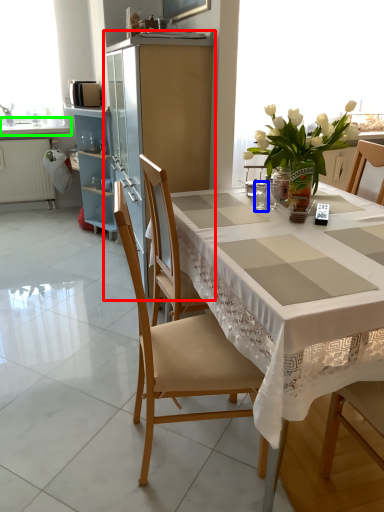
Question: Which object is the closest to the cabinetry (highlighted by a red box)? Choose among these: tableware (highlighted by a blue box) or countertop (highlighted by a green box).

Choices:
 (A) tableware
 (B) countertop

Answer: (A)